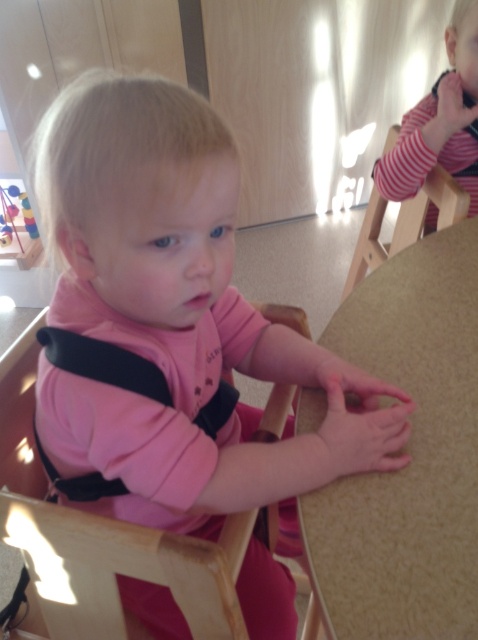
Question: Which point is farther to the camera?

Choices:
 (A) (32, 332)
 (B) (453, 228)
 (C) (365, 468)
 (D) (457, 99)

Answer: (D)

Question: Which of these objects is positioned closest to the pink matte baby carrier at center?

Choices:
 (A) wooden chair at center
 (B) striped fabric shirt at upper right
 (C) beige textured table at center
 (D) wooden chair at upper right

Answer: (A)

Question: Which object appears farthest from the camera in this image?

Choices:
 (A) wooden chair at center
 (B) wooden chair at upper right

Answer: (B)

Question: Can you confirm if pink matte baby carrier at center is positioned below wooden chair at upper right?

Choices:
 (A) no
 (B) yes

Answer: (B)

Question: Can you confirm if beige textured table at center is bigger than striped fabric shirt at upper right?

Choices:
 (A) no
 (B) yes

Answer: (B)

Question: Can you confirm if pink matte baby carrier at center is smaller than beige textured table at center?

Choices:
 (A) no
 (B) yes

Answer: (A)